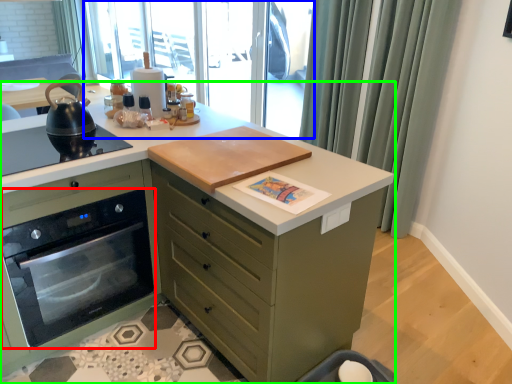
Question: Considering the real-world distances, which object is farthest from home appliance (highlighted by a red box)? window screen (highlighted by a blue box) or countertop (highlighted by a green box)?

Choices:
 (A) window screen
 (B) countertop

Answer: (A)